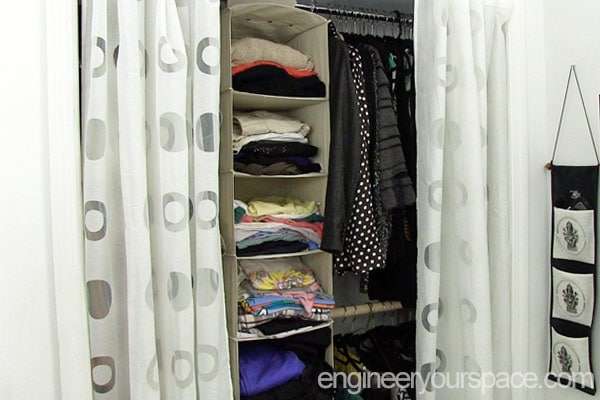
Locate an element on the screen. This screenshot has width=600, height=400. white walls is located at coordinates (26, 217), (548, 61).